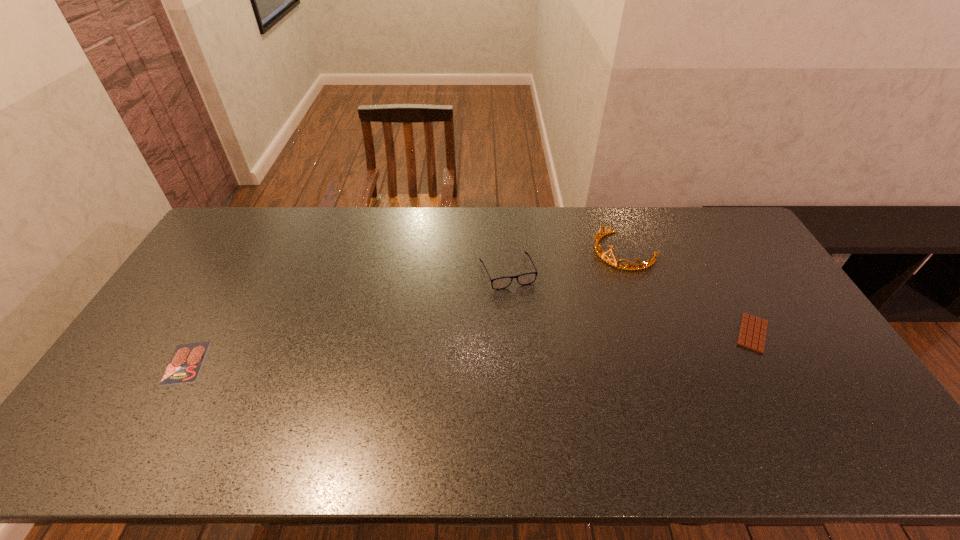
In the image, there is a desktop. Where is `blank space at the near edge`? blank space at the near edge is located at coordinates (475, 389).

This screenshot has height=540, width=960. In the image, there is a desktop. What are the coordinates of `vacant space at the left edge` in the screenshot? It's located at (199, 258).

Find the location of `vacant space at the right edge of the desktop`. vacant space at the right edge of the desktop is located at coordinates (738, 291).

The image size is (960, 540). Identify the location of free area in between the third tallest object and the salami. (469, 348).

Find the location of `free spot between the second tallest object and the tallest object`. free spot between the second tallest object and the tallest object is located at coordinates click(x=565, y=261).

I want to click on empty space that is in between the shortest object and the spectacles, so click(347, 317).

At what (x,y) coordinates should I click in order to perform the action: click on empty space that is in between the shortest object and the tallest object. Please return your answer as a coordinate pair (x, y). The height and width of the screenshot is (540, 960). Looking at the image, I should click on (405, 307).

Find the location of a particular element. This screenshot has height=540, width=960. free spot between the shortest object and the candy bar is located at coordinates (469, 348).

Identify the location of vacant point located between the tiara and the second shortest object. This screenshot has height=540, width=960. (688, 292).

Where is `vacant area that lies between the leftmost object and the spectacles`? Image resolution: width=960 pixels, height=540 pixels. vacant area that lies between the leftmost object and the spectacles is located at coordinates (347, 317).